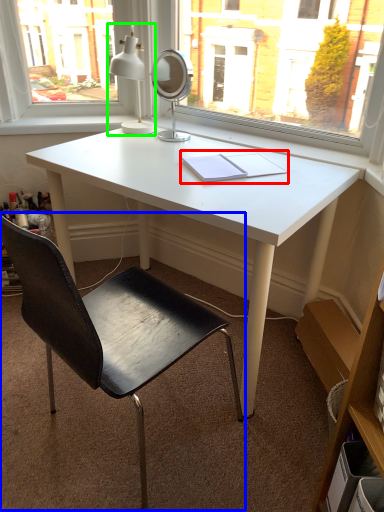
Question: Which is farther away from notebook (highlighted by a red box)? chair (highlighted by a blue box) or table lamp (highlighted by a green box)?

Choices:
 (A) chair
 (B) table lamp

Answer: (A)